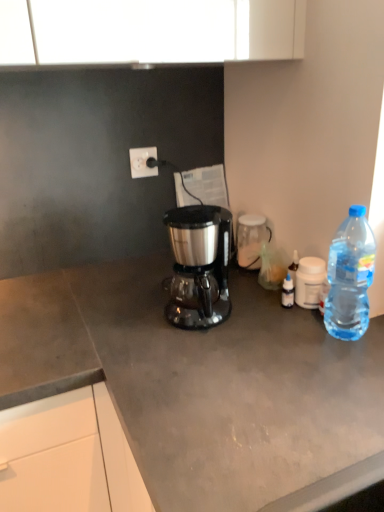
Question: Looking at their shapes, would you say clear plastic bottle at right is wider or thinner than transparent glass jar at center, arranged as the 1th coffee cup when viewed from the back?

Choices:
 (A) wide
 (B) thin

Answer: (A)

Question: Is clear plastic bottle at right bigger or smaller than transparent glass jar at center, arranged as the 1th coffee cup when viewed from the back?

Choices:
 (A) big
 (B) small

Answer: (A)

Question: Which of these objects is positioned farthest from the clear plastic bottle at right?

Choices:
 (A) satin black coffee maker at center
 (B) white plastic power outlet at upper center
 (C) transparent plastic coffee cup at right, the second coffee cup positioned from the back
 (D) transparent glass jar at center, arranged as the 1th coffee cup when viewed from the back
 (E) matte gray countertop at center

Answer: (B)

Question: Estimate the real-world distances between objects in this image. Which object is farther from the transparent glass jar at center, which is the second coffee cup from right to left?

Choices:
 (A) transparent plastic coffee cup at right, arranged as the second coffee cup when viewed from the left
 (B) matte gray countertop at center
 (C) clear plastic bottle at right
 (D) satin black coffee maker at center
 (E) white plastic power outlet at upper center

Answer: (B)